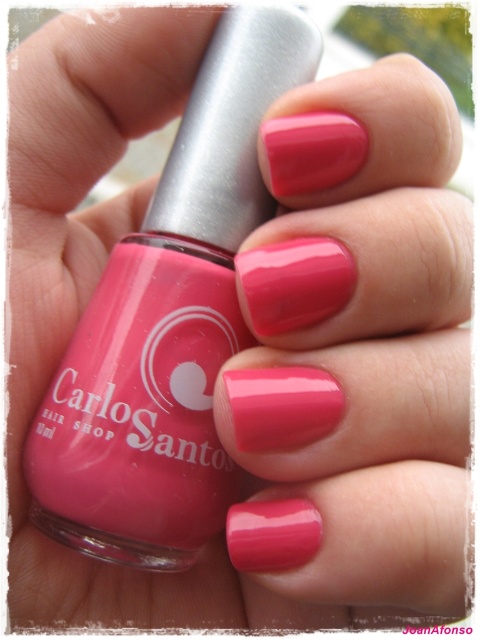
You are a customer at Carlos Santos Hair Shop and want to buy nail polish. You see the glossy pink nails at center and the matte pink nail polish at center in the image. Which one is closer to you?

The glossy pink nails at center is closer to you because it is in front of the matte pink nail polish at center.

You are a nail technician assessing a client. You see the point at coordinates (354,355) which corresponds to the glossy pink nails at center. Based on the nail polish bottle in the image, does the color of the glossy pink nails at center match the color of the bottle?

The glossy pink nails at center match the color of the bottle of nail polish since the description states that the nails are painted with a glossy, vibrant pink nail polish that matches the color of the bottle.

You are a photographer trying to capture a close shot of the nail polish bottle. You want to ensure the subject is in focus. Given that your camera has a depth of field range of 15 inches, will the point at point (372,525) be within the focus range if the camera is focused on the nail polish bottle?

The distance between point (372,525) and the camera is 17.41 inches. Since the depth of field range is 15 inches, the point is outside the focus range, so it will not be in focus.